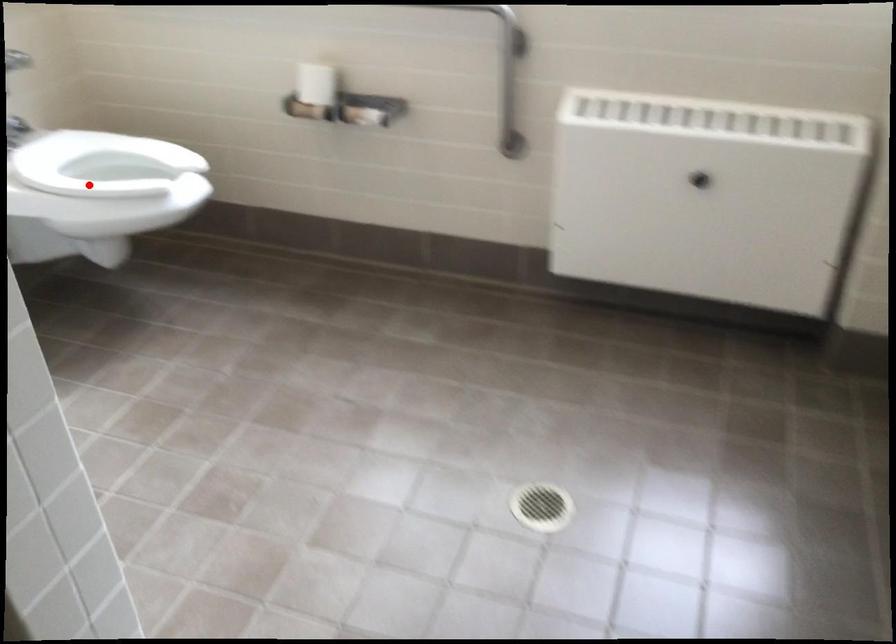
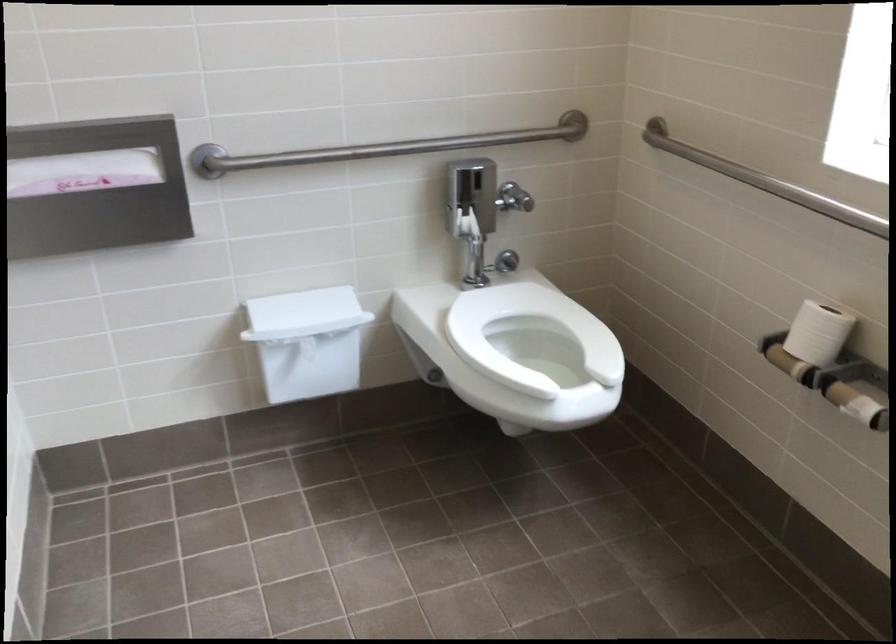
Question: I am providing you with two images of the same scene from different viewpoints. A red point is shown in image1. For the corresponding object point in image2, is it positioned nearer or farther from the camera?

Choices:
 (A) Nearer
 (B) Farther

Answer: (A)